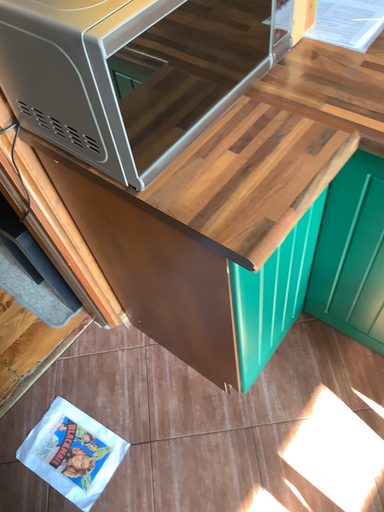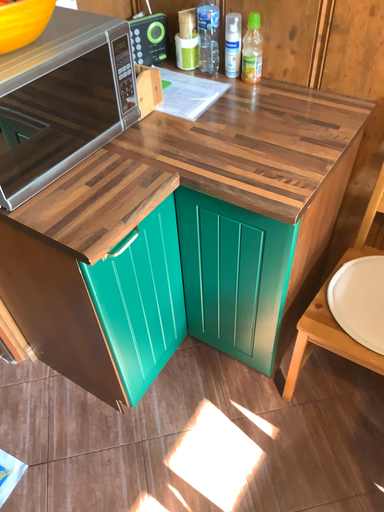
Question: Which way did the camera rotate in the video?

Choices:
 (A) rotated left
 (B) rotated right

Answer: (B)